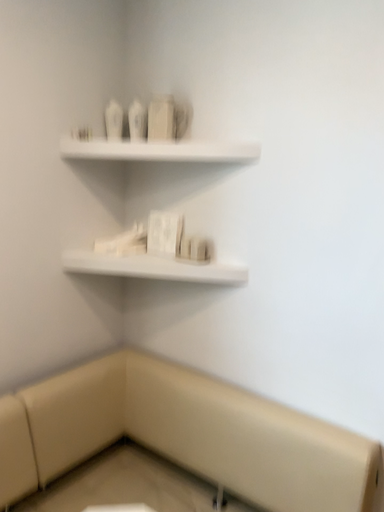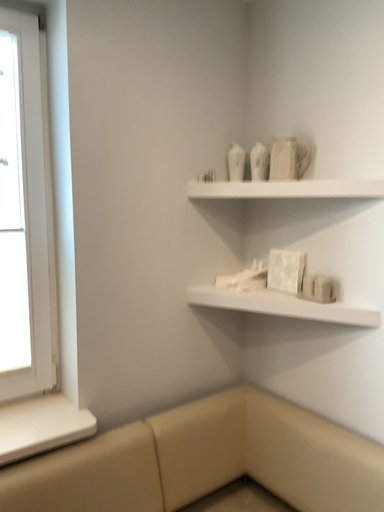
Question: Which way did the camera rotate in the video?

Choices:
 (A) rotated left
 (B) rotated right

Answer: (A)